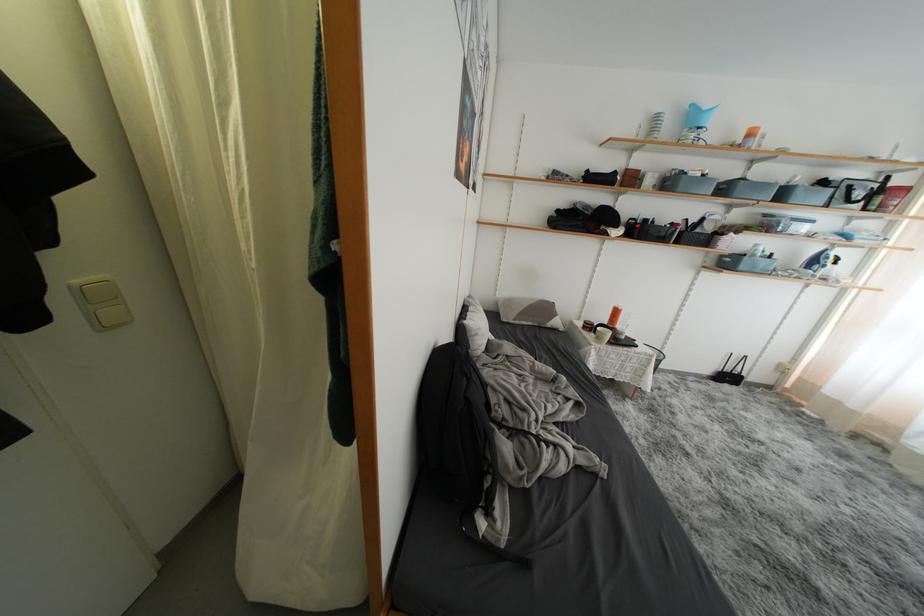
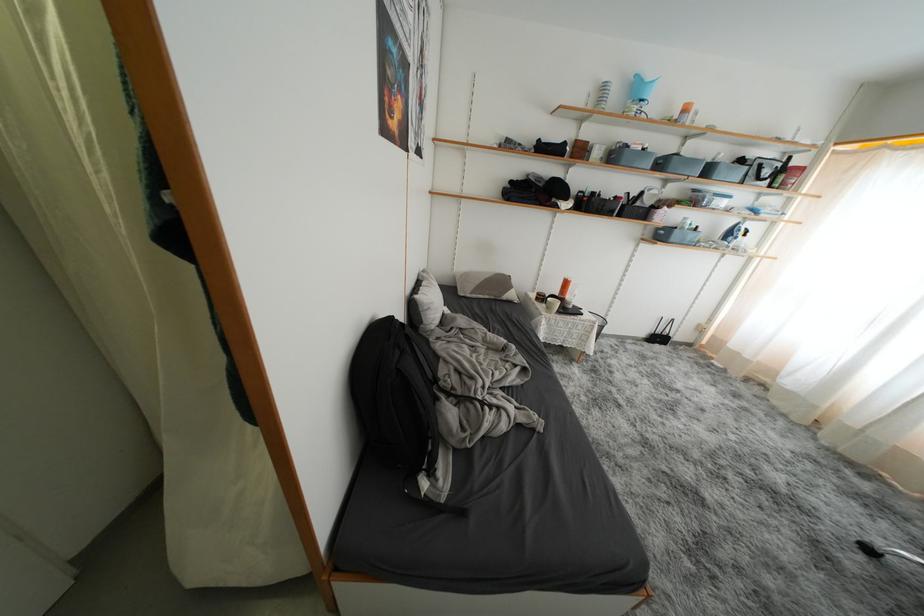
Find the pixel in the second image that matches pixel 622 315 in the first image.

(572, 286)